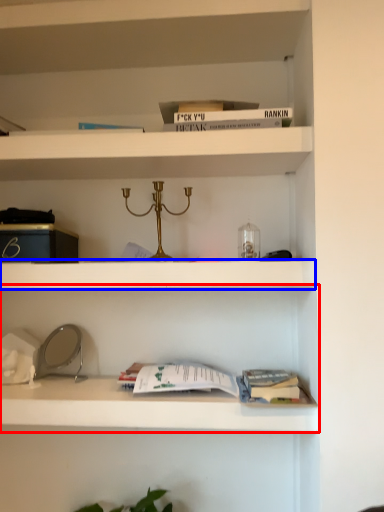
Question: Which object is further to the camera taking this photo, shelf (highlighted by a red box) or cabinet (highlighted by a blue box)?

Choices:
 (A) shelf
 (B) cabinet

Answer: (B)